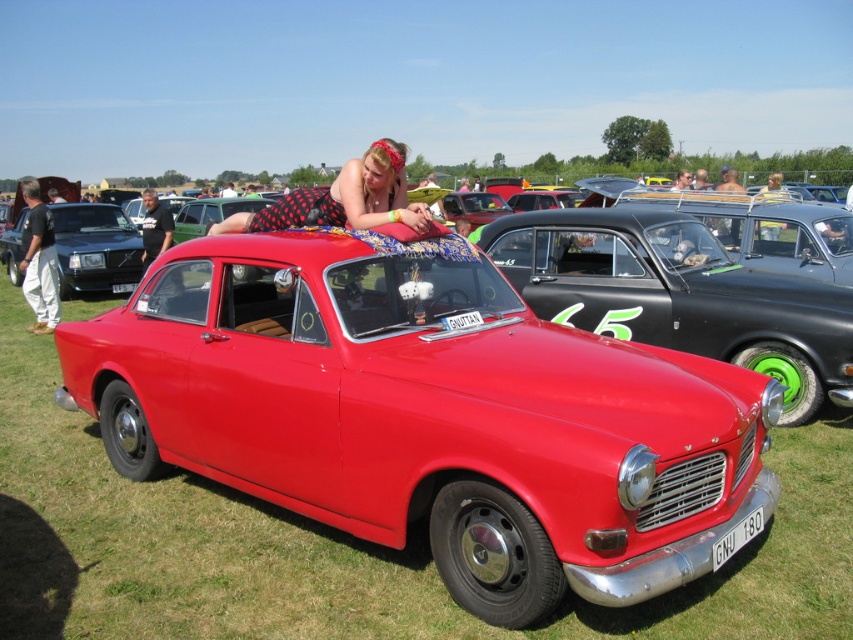
You are a photographer standing at the edge of the car show. You want to take a photo of the green grass at center and the shiny red car at center. Which object is taller in the image?

The shiny red car at center is taller than the green grass at center.

You are standing at the point with coordinates point (283, 634) and want to walk to the point with coordinates point (717, 305). Which direction should you move?

You should move backward because point (283, 634) is in front of point (717, 305).

You are a photographer planning to take a photo of the shiny red car at center and the polka dot fabric at center. Based on their sizes in the scene, which object should you focus on first to ensure both are in frame without cropping?

The shiny red car at center occupies less space than the polka dot fabric at center, so you should focus on the polka dot fabric at center first to ensure both fit in the frame without cropping.